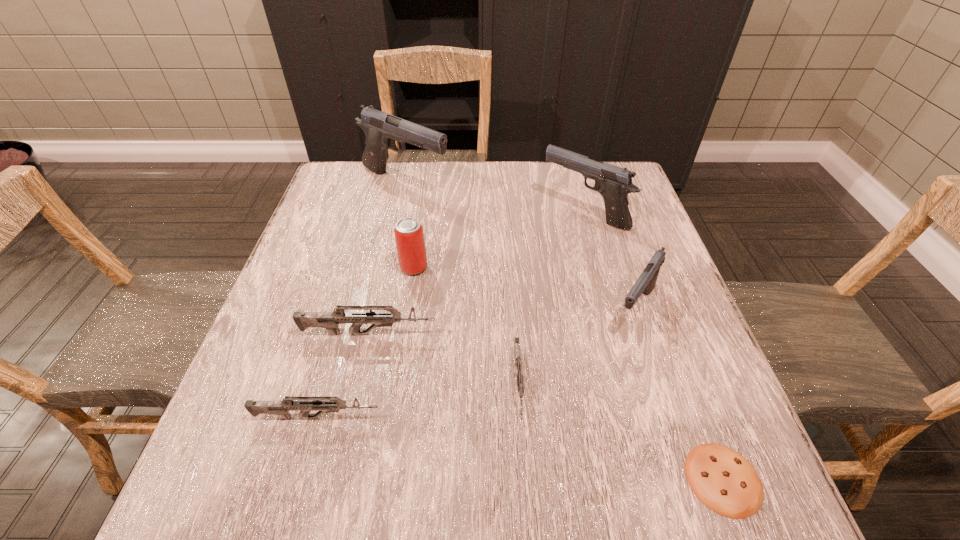
At what (x,y) coordinates should I click in order to perform the action: click on the tallest object. Please return your answer as a coordinate pair (x, y). The image size is (960, 540). Looking at the image, I should click on (381, 129).

Identify the location of the biggest black gun. This screenshot has width=960, height=540. (381, 129).

I want to click on the fifth shortest gun, so click(x=614, y=183).

Where is `the second biggest black gun`? The width and height of the screenshot is (960, 540). the second biggest black gun is located at coordinates (614, 183).

Identify the location of beer can. The image size is (960, 540). coord(409,236).

At what (x,y) coordinates should I click in order to perform the action: click on the third farthest object. Please return your answer as a coordinate pair (x, y). This screenshot has width=960, height=540. Looking at the image, I should click on [x=409, y=236].

Where is `the fourth shortest gun`? This screenshot has width=960, height=540. the fourth shortest gun is located at coordinates (646, 282).

This screenshot has height=540, width=960. Find the location of `the nearest black gun`. the nearest black gun is located at coordinates (646, 282).

Where is `the fifth tallest object`? Image resolution: width=960 pixels, height=540 pixels. the fifth tallest object is located at coordinates (329, 320).

The width and height of the screenshot is (960, 540). Find the location of `the farthest grey gun`. the farthest grey gun is located at coordinates (329, 320).